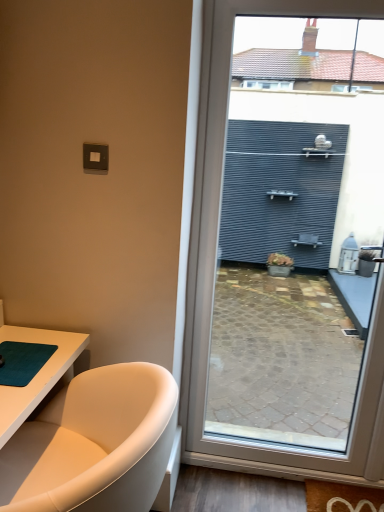
Question: From a real-world perspective, is matte gray wall at right physically above white leather bathtub at lower left?

Choices:
 (A) yes
 (B) no

Answer: (A)

Question: Is matte gray wall at right aimed at white leather bathtub at lower left?

Choices:
 (A) no
 (B) yes

Answer: (A)

Question: From a real-world perspective, does matte gray wall at right sit lower than white leather bathtub at lower left?

Choices:
 (A) yes
 (B) no

Answer: (B)

Question: Can we say matte gray wall at right lies outside white leather bathtub at lower left?

Choices:
 (A) no
 (B) yes

Answer: (B)

Question: Is matte gray wall at right looking in the opposite direction of white leather bathtub at lower left?

Choices:
 (A) yes
 (B) no

Answer: (B)

Question: Is matte gray wall at right at the right side of white leather bathtub at lower left?

Choices:
 (A) no
 (B) yes

Answer: (B)

Question: Can you confirm if teal matte yoga mat at lower left is thinner than white leather bathtub at lower left?

Choices:
 (A) yes
 (B) no

Answer: (A)

Question: Does teal matte yoga mat at lower left have a greater height compared to white leather bathtub at lower left?

Choices:
 (A) no
 (B) yes

Answer: (A)

Question: Is teal matte yoga mat at lower left beside white leather bathtub at lower left?

Choices:
 (A) no
 (B) yes

Answer: (A)

Question: From the image's perspective, is teal matte yoga mat at lower left located beneath white leather bathtub at lower left?

Choices:
 (A) yes
 (B) no

Answer: (B)

Question: Is teal matte yoga mat at lower left at the left side of white leather bathtub at lower left?

Choices:
 (A) yes
 (B) no

Answer: (A)

Question: Is teal matte yoga mat at lower left outside white leather bathtub at lower left?

Choices:
 (A) no
 (B) yes

Answer: (A)

Question: Is white leather bathtub at lower left thinner than matte gray wall at right?

Choices:
 (A) no
 (B) yes

Answer: (A)